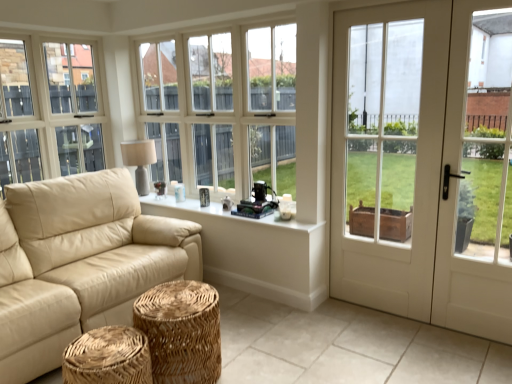
Question: Can you confirm if white glossy door at right is wider than beige leather couch at left?

Choices:
 (A) no
 (B) yes

Answer: (A)

Question: From a real-world perspective, is white glossy door at right located higher than beige leather couch at left?

Choices:
 (A) no
 (B) yes

Answer: (B)

Question: Is white glossy door at right positioned before beige leather couch at left?

Choices:
 (A) yes
 (B) no

Answer: (B)

Question: Considering the relative sizes of white glossy door at right and beige leather couch at left in the image provided, is white glossy door at right taller than beige leather couch at left?

Choices:
 (A) no
 (B) yes

Answer: (B)

Question: From the image's perspective, would you say white glossy door at right is shown under beige leather couch at left?

Choices:
 (A) yes
 (B) no

Answer: (B)

Question: From the image's perspective, is white glossy door at right on top of beige leather couch at left?

Choices:
 (A) no
 (B) yes

Answer: (B)

Question: Can you confirm if matte beige lampshade at upper left is positioned to the left of white wood window at center?

Choices:
 (A) yes
 (B) no

Answer: (A)

Question: Is matte beige lampshade at upper left next to white wood window at center and touching it?

Choices:
 (A) yes
 (B) no

Answer: (B)

Question: Is matte beige lampshade at upper left thinner than white wood window at center?

Choices:
 (A) no
 (B) yes

Answer: (A)

Question: Does matte beige lampshade at upper left have a larger size compared to white wood window at center?

Choices:
 (A) yes
 (B) no

Answer: (B)

Question: From the image's perspective, is matte beige lampshade at upper left beneath white wood window at center?

Choices:
 (A) no
 (B) yes

Answer: (B)

Question: Is matte beige lampshade at upper left facing towards white wood window at center?

Choices:
 (A) no
 (B) yes

Answer: (B)

Question: Is white painted wood at center, acting as the second window sill starting from the bottom, facing away from matte beige lampshade at upper left?

Choices:
 (A) no
 (B) yes

Answer: (A)